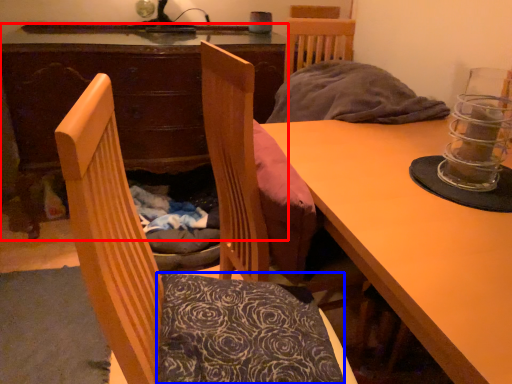
Question: Among these objects, which one is nearest to the camera, desk (highlighted by a red box) or pillow (highlighted by a blue box)?

Choices:
 (A) desk
 (B) pillow

Answer: (B)